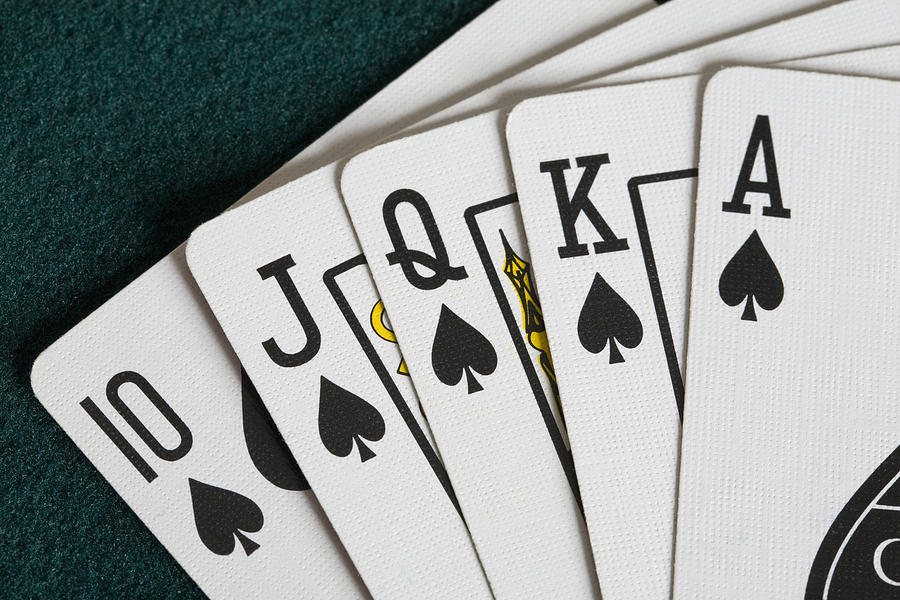
Identify the location of suite. (230, 511), (346, 430), (471, 352), (621, 324), (749, 270).